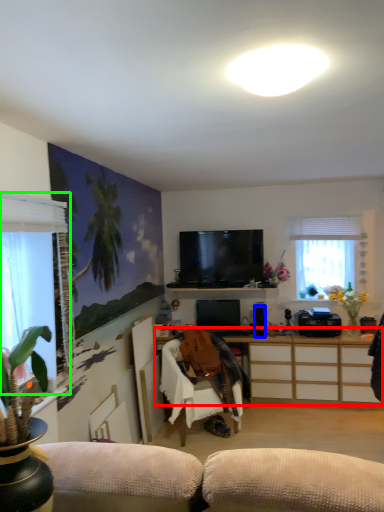
Question: Estimate the real-world distances between objects in this image. Which object is closer to cabinetry (highlighted by a red box), speaker (highlighted by a blue box) or window (highlighted by a green box)?

Choices:
 (A) speaker
 (B) window

Answer: (A)